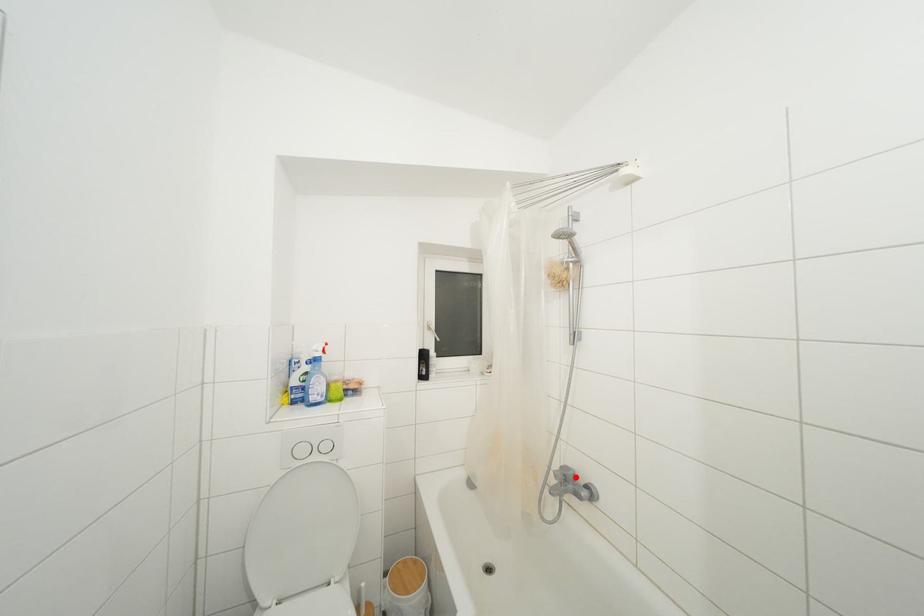
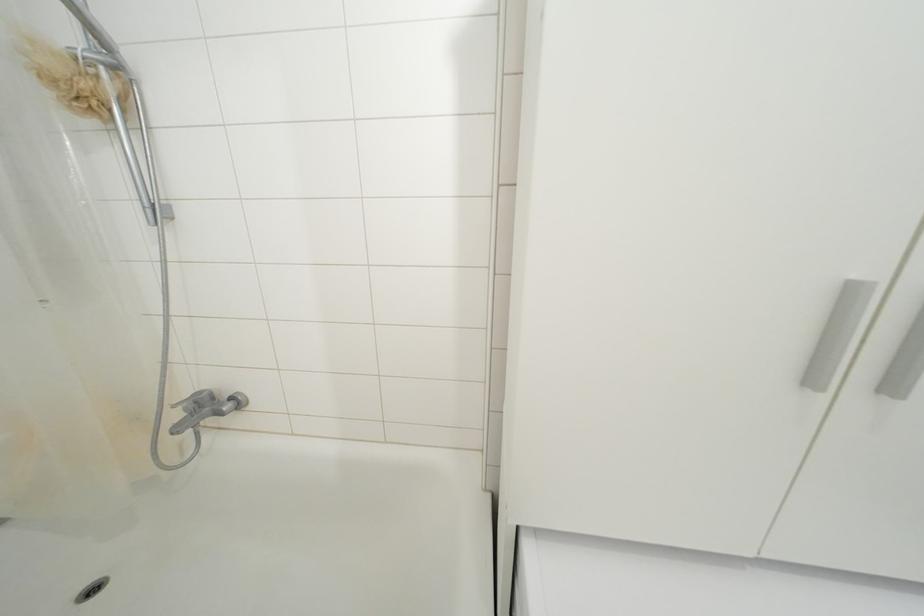
Find the pixel in the second image that matches the highlighted location in the first image.

(209, 398)